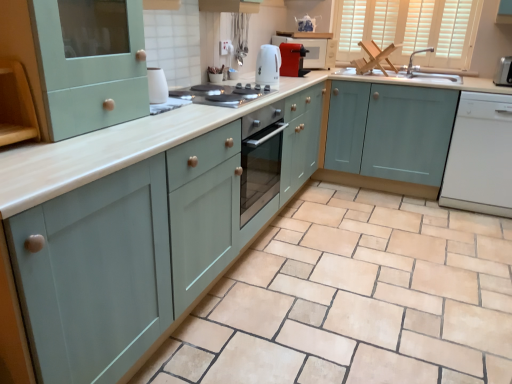
At what (x,y) coordinates should I click in order to perform the action: click on vacant space in front of mint green wood cabinet at upper left, the third cabinetry positioned from the right. Please return your answer as a coordinate pair (x, y). The image size is (512, 384). Looking at the image, I should click on (67, 157).